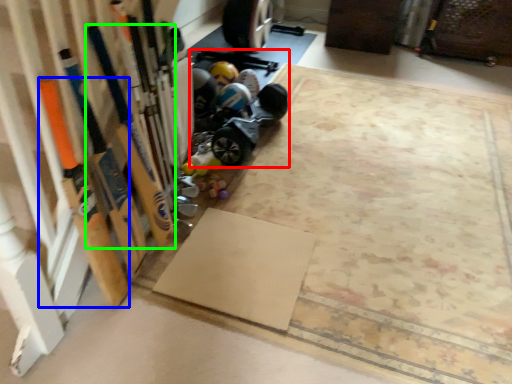
Question: Based on their relative distances, which object is farther from car (highlighted by a red box)? Choose from baseball bat (highlighted by a blue box) and baseball bat (highlighted by a green box).

Choices:
 (A) baseball bat
 (B) baseball bat

Answer: (A)